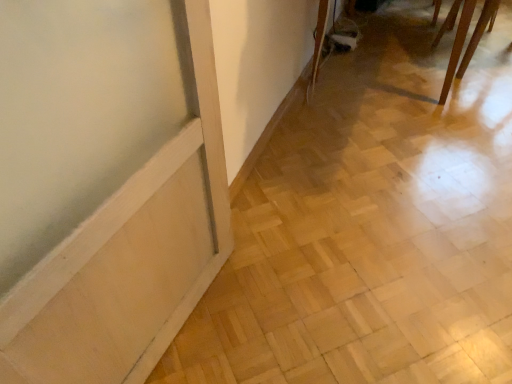
Where is `vacant region above light wood parquet floor at lower left (from a real-world perspective)`? vacant region above light wood parquet floor at lower left (from a real-world perspective) is located at coordinates (380, 187).